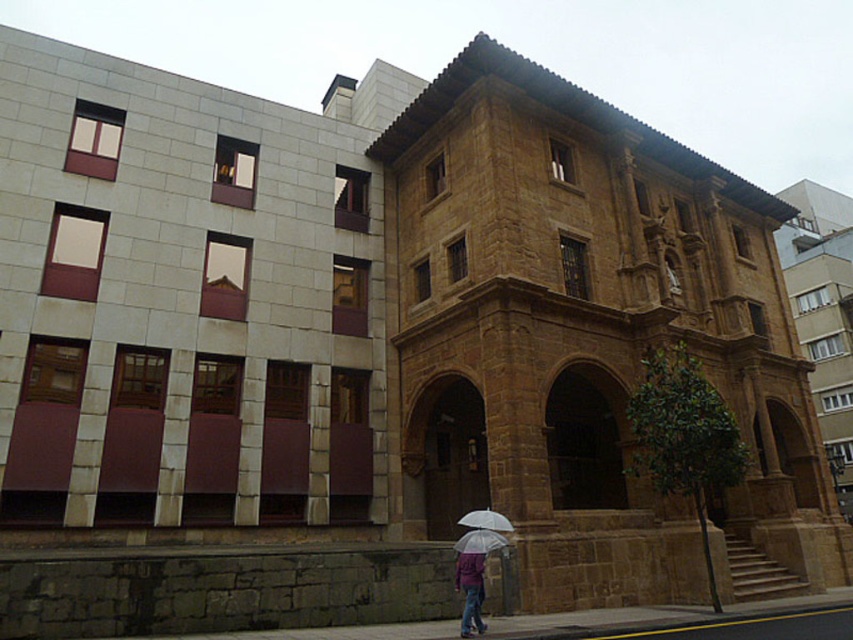
Is point (477, 579) positioned after point (492, 529)?

No.

Who is more forward, (466, 632) or (495, 515)?

Point (466, 632) is in front.

Find the location of `purple matte jacket at lower center`. purple matte jacket at lower center is located at coordinates (469, 592).

Can you confirm if purple matte jacket at lower center is positioned below transparent plastic umbrella at center?

Correct, purple matte jacket at lower center is located below transparent plastic umbrella at center.

Between point (479, 568) and point (456, 545), which one is positioned behind?

Point (456, 545)

Is point (457, 572) behind point (463, 540)?

That is True.

Locate an element on the screen. purple matte jacket at lower center is located at coordinates 469,592.

Looking at this image, can you confirm if transparent plastic umbrella at center is shorter than white matte umbrella at center?

Yes, transparent plastic umbrella at center is shorter than white matte umbrella at center.

How much distance is there between transparent plastic umbrella at center and white matte umbrella at center?

transparent plastic umbrella at center and white matte umbrella at center are 1.22 meters apart.

Between point (482, 548) and point (498, 524), which one is positioned behind?

Positioned behind is point (498, 524).

The height and width of the screenshot is (640, 853). Find the location of `transparent plastic umbrella at center`. transparent plastic umbrella at center is located at coordinates (480, 541).